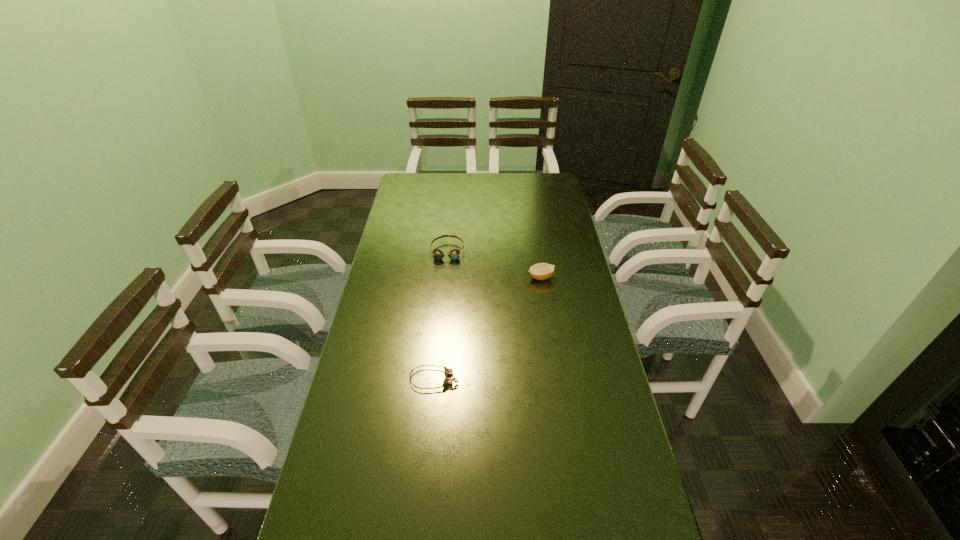
I want to click on free space that is in between the shorter goggles and the lemon, so click(488, 328).

In order to click on vacant space in between the shortest object and the taller goggles in this screenshot , I will do `click(441, 315)`.

The height and width of the screenshot is (540, 960). Identify the location of vacant area between the shortest object and the rightmost object. (488, 328).

You are a GUI agent. You are given a task and a screenshot of the screen. Output one action in this format:
    pyautogui.click(x=<x>, y=<y>)
    Task: Click on the vacant area that lies between the rightmost object and the farthest object
    The width and height of the screenshot is (960, 540).
    Given the screenshot: What is the action you would take?
    pyautogui.click(x=494, y=264)

Find the location of a particular element. The height and width of the screenshot is (540, 960). free space between the farther goggles and the nearest object is located at coordinates (441, 315).

Locate an element on the screen. Image resolution: width=960 pixels, height=540 pixels. object that ranks as the closest to the nearer goggles is located at coordinates (541, 271).

You are a GUI agent. You are given a task and a screenshot of the screen. Output one action in this format:
    pyautogui.click(x=<x>, y=<y>)
    Task: Click on the object that is the closest to the farther goggles
    
    Given the screenshot: What is the action you would take?
    pyautogui.click(x=541, y=271)

Locate an element on the screen. The height and width of the screenshot is (540, 960). vacant region that satisfies the following two spatial constraints: 1. through the lenses of the farthest object; 2. on the front lenses and sides of the nearest object is located at coordinates tap(436, 379).

Image resolution: width=960 pixels, height=540 pixels. Identify the location of blank area in the image that satisfies the following two spatial constraints: 1. through the lenses of the taller goggles; 2. on the front lenses and sides of the shorter goggles. (436, 379).

Locate an element on the screen. This screenshot has width=960, height=540. vacant area that satisfies the following two spatial constraints: 1. on the front side of the rightmost object; 2. on the front lenses and sides of the shortest object is located at coordinates (557, 379).